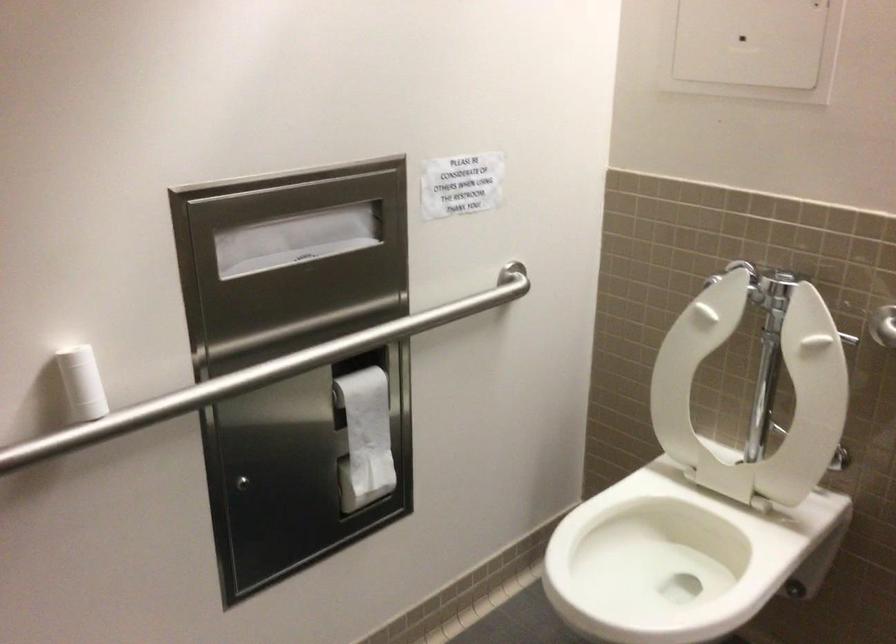
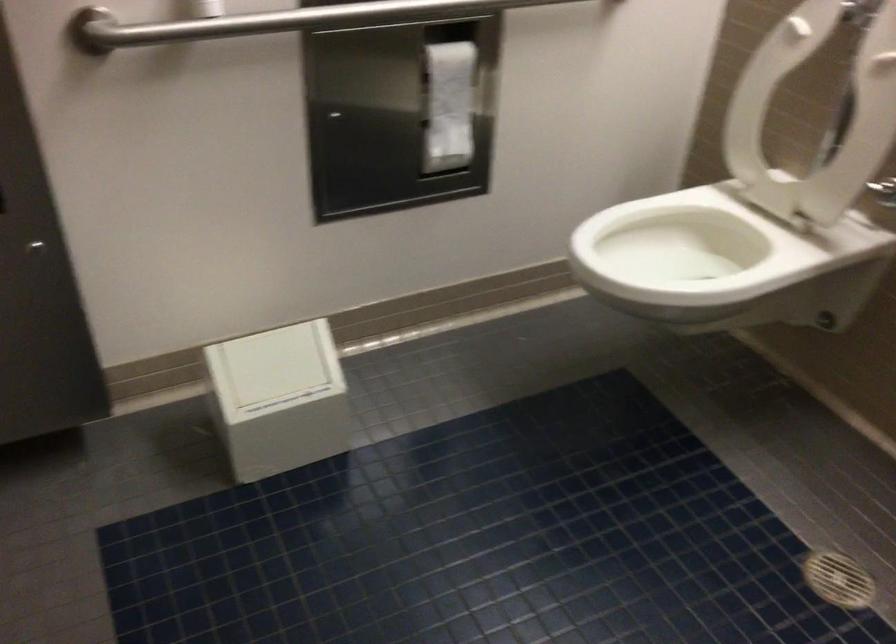
The point at (187, 401) is marked in the first image. Where is the corresponding point in the second image?

(279, 21)